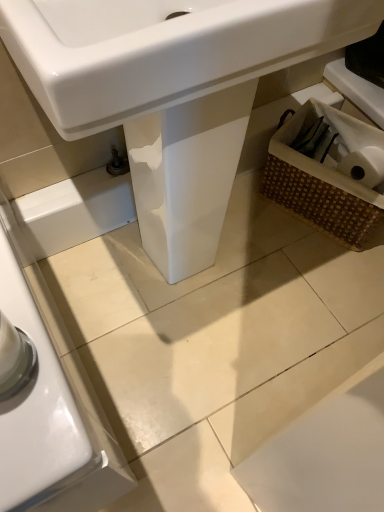
Identify the location of vacant space in front of woven brown basket at lower right. This screenshot has width=384, height=512. (319, 269).